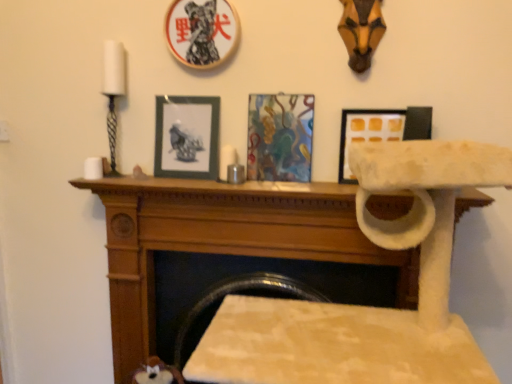
The height and width of the screenshot is (384, 512). Describe the element at coordinates (222, 240) in the screenshot. I see `white felt cat tree at center` at that location.

The width and height of the screenshot is (512, 384). Describe the element at coordinates (187, 137) in the screenshot. I see `blue-gray matte picture frame at center, which is counted as the first picture frame, starting from the left` at that location.

Identify the location of white matte picture frame at upper center, the 4th picture frame positioned from the left. (380, 130).

What is the approximate height of wooden picture frame at upper center, the third picture frame viewed from the right?

wooden picture frame at upper center, the third picture frame viewed from the right, is 11.37 inches tall.

What are the coordinates of `abstract painting at center, the 3th picture frame from the left` in the screenshot? It's located at (280, 137).

Is blue-gray matte picture frame at center, arranged as the fourth picture frame when viewed from the right, outside of abstract painting at center, the second picture frame when ordered from right to left?

Yes.

Locate an element on the screen. the 2nd picture frame to the left when counting from the abstract painting at center, the 3th picture frame from the left is located at coordinates (187, 137).

From a real-world perspective, between blue-gray matte picture frame at center, arranged as the fourth picture frame when viewed from the right, and abstract painting at center, the second picture frame when ordered from right to left, who is vertically higher?

abstract painting at center, the second picture frame when ordered from right to left, from a real-world perspective.

Could you tell me if wooden mantle at center is turned towards blue-gray matte picture frame at center, which is counted as the first picture frame, starting from the left?

No, wooden mantle at center is not facing towards blue-gray matte picture frame at center, which is counted as the first picture frame, starting from the left.

Considering the sizes of objects wooden mantle at center and blue-gray matte picture frame at center, arranged as the fourth picture frame when viewed from the right, in the image provided, who is thinner, wooden mantle at center or blue-gray matte picture frame at center, arranged as the fourth picture frame when viewed from the right,?

With smaller width is blue-gray matte picture frame at center, arranged as the fourth picture frame when viewed from the right.

From the image's perspective, which is above, wooden mantle at center or blue-gray matte picture frame at center, which is counted as the first picture frame, starting from the left?

blue-gray matte picture frame at center, which is counted as the first picture frame, starting from the left, is shown above in the image.

Considering the points (185, 189) and (174, 157), which point is behind, point (185, 189) or point (174, 157)?

The point (174, 157) is behind.

Considering the sizes of wooden mantle at center and abstract painting at center, the second picture frame when ordered from right to left, in the image, is wooden mantle at center taller or shorter than abstract painting at center, the second picture frame when ordered from right to left,?

In the image, wooden mantle at center appears to be shorter than abstract painting at center, the second picture frame when ordered from right to left.

Which object is closer to the camera taking this photo, wooden mantle at center or abstract painting at center, the second picture frame when ordered from right to left?

wooden mantle at center is in front.

Does wooden mantle at center appear on the right side of abstract painting at center, the second picture frame when ordered from right to left?

No.

From the image's perspective, between wooden mantle at center and abstract painting at center, the second picture frame when ordered from right to left, who is located below?

wooden mantle at center is shown below in the image.

Is white matte picture frame at upper center, arranged as the first picture frame when viewed from the right, located within abstract painting at center, the 3th picture frame from the left?

No.

Between abstract painting at center, the second picture frame when ordered from right to left, and white matte picture frame at upper center, the 4th picture frame positioned from the left, which one has larger width?

With larger width is white matte picture frame at upper center, the 4th picture frame positioned from the left.

Between abstract painting at center, the 3th picture frame from the left, and white matte picture frame at upper center, arranged as the first picture frame when viewed from the right, which one appears on the right side from the viewer's perspective?

white matte picture frame at upper center, arranged as the first picture frame when viewed from the right, is more to the right.

Looking at this image, from their relative heights in the image, would you say abstract painting at center, the second picture frame when ordered from right to left, is taller or shorter than white matte picture frame at upper center, the 4th picture frame positioned from the left?

In the image, abstract painting at center, the second picture frame when ordered from right to left, appears to be taller than white matte picture frame at upper center, the 4th picture frame positioned from the left.

Which is farther, (284,155) or (221,23)?

Point (284,155)

Which of these two, abstract painting at center, the 3th picture frame from the left, or wooden picture frame at upper center, the third picture frame viewed from the right, stands taller?

With more height is abstract painting at center, the 3th picture frame from the left.

Locate an element on the screen. The image size is (512, 384). the 1st picture frame to the left of the abstract painting at center, the second picture frame when ordered from right to left, counting from the anchor's position is located at coordinates (201, 32).

Is abstract painting at center, the 3th picture frame from the left, not near wooden picture frame at upper center, the 2th picture frame from the left?

No, abstract painting at center, the 3th picture frame from the left, is not far away from wooden picture frame at upper center, the 2th picture frame from the left.

How far apart are white matte picture frame at upper center, the 4th picture frame positioned from the left, and white felt cat tree at center?

A distance of 15.65 inches exists between white matte picture frame at upper center, the 4th picture frame positioned from the left, and white felt cat tree at center.

Can you confirm if white matte picture frame at upper center, the 4th picture frame positioned from the left, is positioned to the right of white felt cat tree at center?

Yes.

Do you think white matte picture frame at upper center, the 4th picture frame positioned from the left, is within white felt cat tree at center, or outside of it?

white matte picture frame at upper center, the 4th picture frame positioned from the left, exists outside the volume of white felt cat tree at center.

Is white felt cat tree at center oriented away from blue-gray matte picture frame at center, arranged as the fourth picture frame when viewed from the right?

No.

Is white felt cat tree at center inside the boundaries of blue-gray matte picture frame at center, which is counted as the first picture frame, starting from the left, or outside?

white felt cat tree at center is outside blue-gray matte picture frame at center, which is counted as the first picture frame, starting from the left.

Locate an element on the screen. The width and height of the screenshot is (512, 384). furniture below the blue-gray matte picture frame at center, which is counted as the first picture frame, starting from the left (from the image's perspective) is located at coordinates (222, 240).

Where is `the 2nd picture frame counting from the left side of the abstract painting at center, the 3th picture frame from the left`? This screenshot has height=384, width=512. the 2nd picture frame counting from the left side of the abstract painting at center, the 3th picture frame from the left is located at coordinates (187, 137).

Find the location of a particular element. This screenshot has height=384, width=512. mantle on the right side of blue-gray matte picture frame at center, arranged as the fourth picture frame when viewed from the right is located at coordinates (222, 193).

Which object lies further to the anchor point wooden mantle at center, white felt cat tree at center or blue-gray matte picture frame at center, arranged as the fourth picture frame when viewed from the right?

Among the two, blue-gray matte picture frame at center, arranged as the fourth picture frame when viewed from the right, is located further to wooden mantle at center.

Estimate the real-world distances between objects in this image. Which object is closer to wooden picture frame at upper center, the third picture frame viewed from the right, white matte picture frame at upper center, arranged as the first picture frame when viewed from the right, or blue-gray matte picture frame at center, arranged as the fourth picture frame when viewed from the right?

blue-gray matte picture frame at center, arranged as the fourth picture frame when viewed from the right, is positioned closer to the anchor wooden picture frame at upper center, the third picture frame viewed from the right.

When comparing their distances from wooden mantle at center, does wooden picture frame at upper center, the 2th picture frame from the left, or blue-gray matte picture frame at center, arranged as the fourth picture frame when viewed from the right, seem further?

Based on the image, wooden picture frame at upper center, the 2th picture frame from the left, appears to be further to wooden mantle at center.

Estimate the real-world distances between objects in this image. Which object is closer to blue-gray matte picture frame at center, which is counted as the first picture frame, starting from the left, wooden picture frame at upper center, the third picture frame viewed from the right, or white felt cat tree at center?

wooden picture frame at upper center, the third picture frame viewed from the right.

Based on the photo, when comparing their distances from white matte picture frame at upper center, arranged as the first picture frame when viewed from the right, does abstract painting at center, the second picture frame when ordered from right to left, or white felt cat tree at center seem further?

white felt cat tree at center.

Estimate the real-world distances between objects in this image. Which object is closer to abstract painting at center, the 3th picture frame from the left, blue-gray matte picture frame at center, arranged as the fourth picture frame when viewed from the right, or wooden picture frame at upper center, the third picture frame viewed from the right?

Among the two, blue-gray matte picture frame at center, arranged as the fourth picture frame when viewed from the right, is located nearer to abstract painting at center, the 3th picture frame from the left.

When comparing their distances from white matte picture frame at upper center, arranged as the first picture frame when viewed from the right, does white felt cat tree at center or blue-gray matte picture frame at center, which is counted as the first picture frame, starting from the left, seem closer?

white felt cat tree at center is positioned closer to the anchor white matte picture frame at upper center, arranged as the first picture frame when viewed from the right.

Considering their positions, is abstract painting at center, the second picture frame when ordered from right to left, positioned closer to blue-gray matte picture frame at center, which is counted as the first picture frame, starting from the left, than white felt cat tree at center?

abstract painting at center, the second picture frame when ordered from right to left, lies closer to blue-gray matte picture frame at center, which is counted as the first picture frame, starting from the left, than the other object.

Find the location of a particular element. mantle between white matte picture frame at upper center, arranged as the first picture frame when viewed from the right, and white felt cat tree at center, in the vertical direction is located at coordinates (222, 193).

Where is `picture frame between wooden picture frame at upper center, the 2th picture frame from the left, and abstract painting at center, the second picture frame when ordered from right to left, vertically`? picture frame between wooden picture frame at upper center, the 2th picture frame from the left, and abstract painting at center, the second picture frame when ordered from right to left, vertically is located at coordinates (187, 137).

The height and width of the screenshot is (384, 512). Identify the location of mantle between blue-gray matte picture frame at center, arranged as the fourth picture frame when viewed from the right, and white matte picture frame at upper center, arranged as the first picture frame when viewed from the right, in the horizontal direction. (222, 193).

Find the location of a particular element. This screenshot has height=384, width=512. mantle between blue-gray matte picture frame at center, which is counted as the first picture frame, starting from the left, and white felt cat tree at center in the up-down direction is located at coordinates (222, 193).